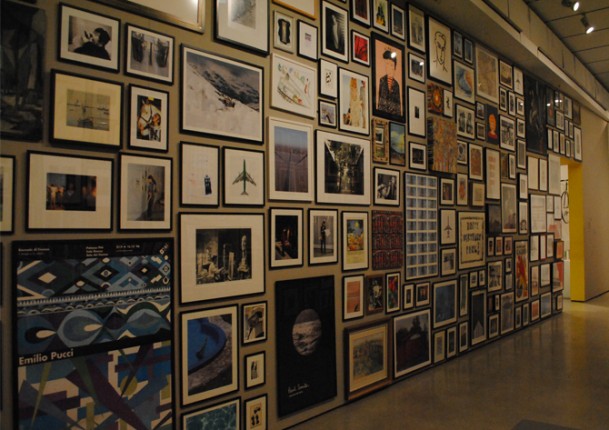
You are a GUI agent. You are given a task and a screenshot of the screen. Output one action in this format:
    pyautogui.click(x=<x>, y=<y>)
    Task: Click on the light
    The height and width of the screenshot is (430, 609).
    Given the screenshot: What is the action you would take?
    pyautogui.click(x=575, y=2), pyautogui.click(x=589, y=27)